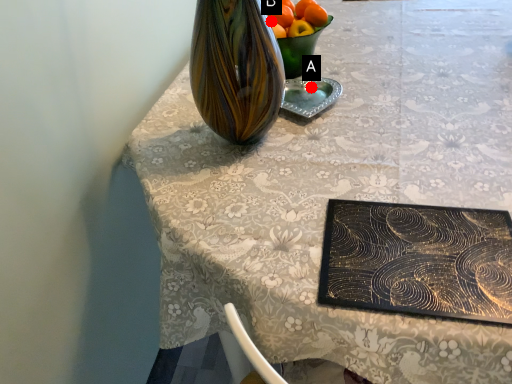
Question: Two points are circled on the image, labeled by A and B beside each circle. Which of the following is the farthest from the observer?

Choices:
 (A) A is further
 (B) B is further

Answer: (A)